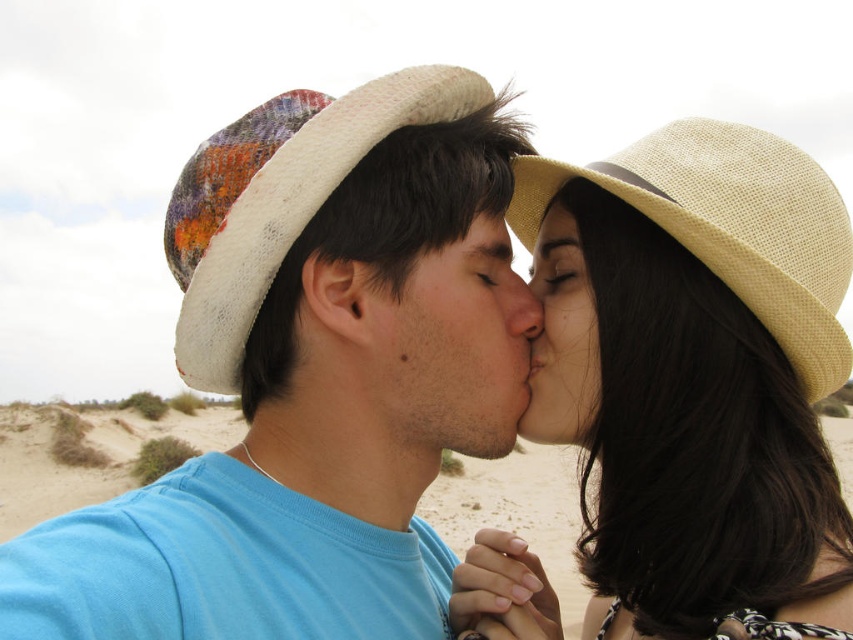
You are a photographer trying to capture a closeup of the smooth skin nose at center. However, the beige straw hat at right is blocking your view. Can you adjust your position to see the nose without moving the hat?

The beige straw hat at right is closer to the viewer than the smooth skin nose at center, so moving your position to the left might allow you to see the nose by positioning the hat out of the way.

You are standing in the open sandy area where the couple is kissing. You need to locate the beige straw hat at right. Which direction should you look relative to the couple?

The beige straw hat at right is located at point (695, 380), which is to the right side of the couple.